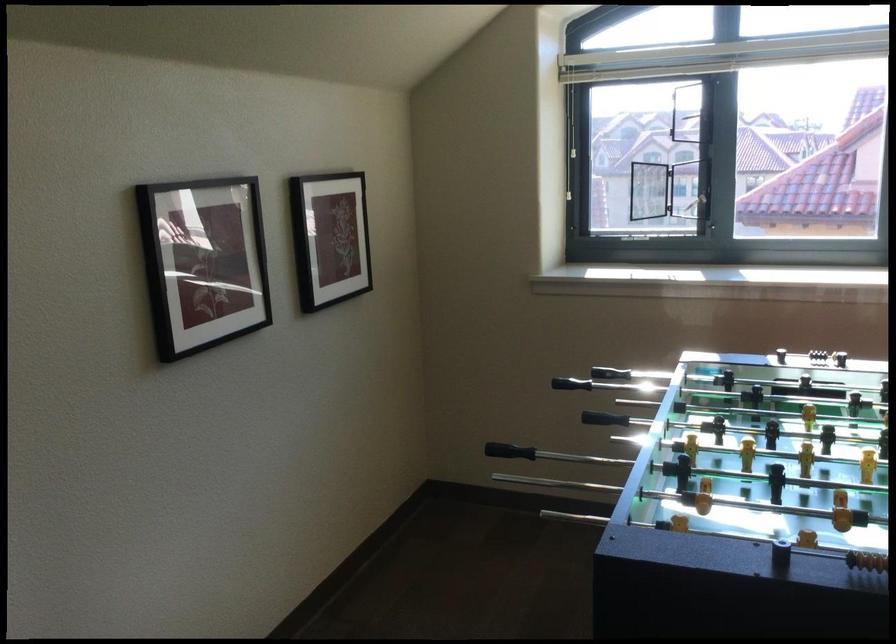
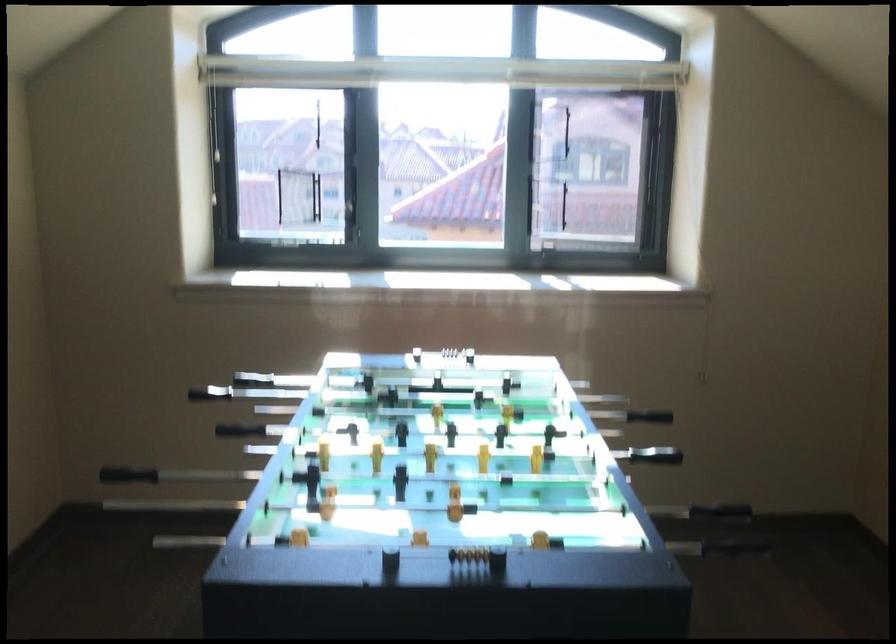
Question: The camera is either moving clockwise (left) or counter-clockwise (right) around the object. The first image is from the beginning of the video and the second image is from the end. Is the camera moving left or right when shooting the video?

Choices:
 (A) Left
 (B) Right

Answer: (A)